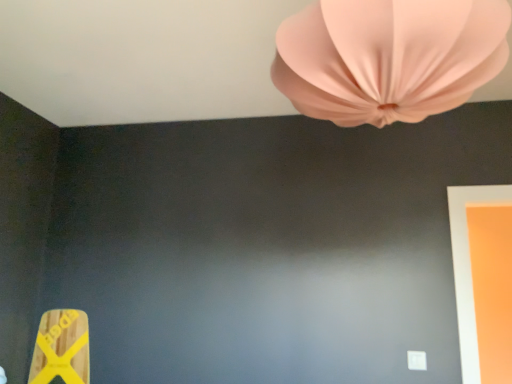
Locate an element on the screen. The image size is (512, 384). pink paper flower at upper center is located at coordinates (388, 58).

In order to face pink paper flower at upper center, should I rotate leftwards or rightwards?

Rotate right and turn 16.410 degrees.

Describe the element at coordinates (388, 58) in the screenshot. I see `pink paper flower at upper center` at that location.

Where is `pink paper flower at upper center`? pink paper flower at upper center is located at coordinates (388, 58).